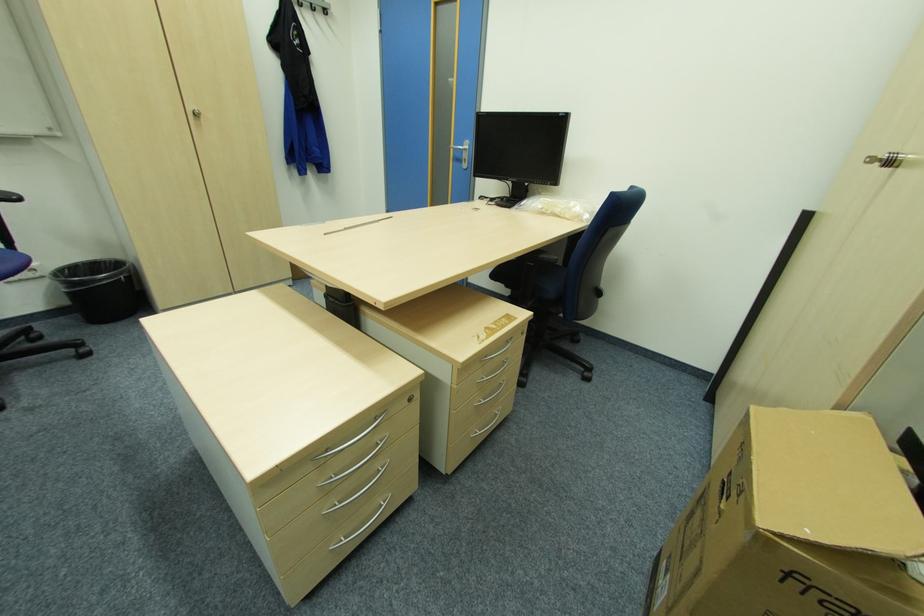
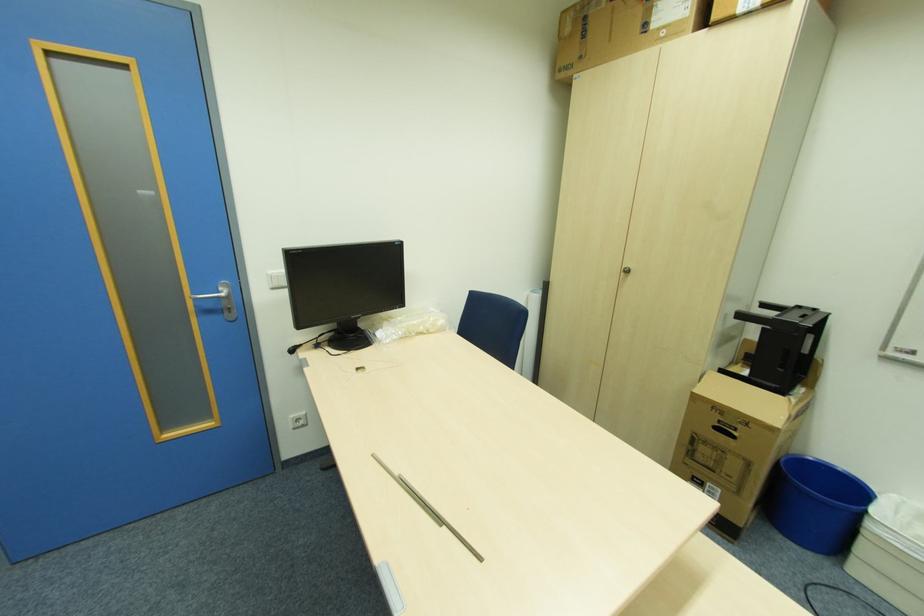
Find the pixel in the second image that matches the point at 742,495 in the first image.

(748, 424)